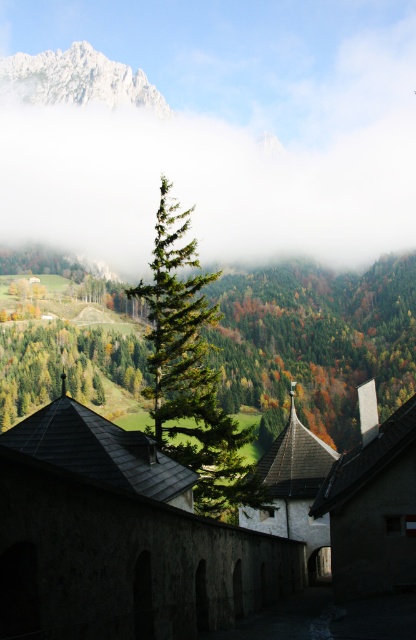
You are standing at the stone wall with arched openings in the foreground of the mountainous landscape. You notice a point marked at coordinates (192, 372). What object is located at this point?

The point at coordinates (192, 372) corresponds to the green needlelike tree at center.